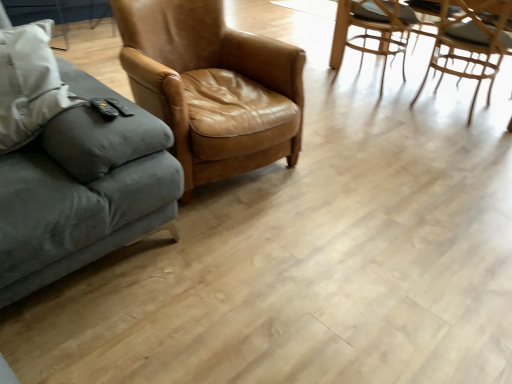
Question: Can you confirm if light brown woven chair at upper right, the 2th chair viewed from the right, is wider than velvet gray couch at left?

Choices:
 (A) yes
 (B) no

Answer: (B)

Question: From a real-world perspective, does light brown woven chair at upper right, positioned as the 2th chair in left-to-right order, stand above velvet gray couch at left?

Choices:
 (A) yes
 (B) no

Answer: (B)

Question: Can you confirm if light brown woven chair at upper right, the 2th chair viewed from the right, is bigger than velvet gray couch at left?

Choices:
 (A) yes
 (B) no

Answer: (B)

Question: Considering the relative sizes of light brown woven chair at upper right, the 2th chair viewed from the right, and velvet gray couch at left in the image provided, is light brown woven chair at upper right, the 2th chair viewed from the right, shorter than velvet gray couch at left?

Choices:
 (A) yes
 (B) no

Answer: (A)

Question: Is light brown woven chair at upper right, positioned as the 2th chair in left-to-right order, in front of velvet gray couch at left?

Choices:
 (A) no
 (B) yes

Answer: (A)

Question: Does light brown woven chair at upper right, the 2th chair viewed from the right, touch velvet gray couch at left?

Choices:
 (A) no
 (B) yes

Answer: (A)

Question: Can you confirm if brown leather chair at center, the 3th chair in the right-to-left sequence, is thinner than velvet gray couch at left?

Choices:
 (A) yes
 (B) no

Answer: (A)

Question: From the image's perspective, would you say brown leather chair at center, the 1th chair positioned from the left, is positioned over velvet gray couch at left?

Choices:
 (A) no
 (B) yes

Answer: (B)

Question: Is brown leather chair at center, the 3th chair in the right-to-left sequence, not within velvet gray couch at left?

Choices:
 (A) yes
 (B) no

Answer: (A)

Question: Does brown leather chair at center, the 3th chair in the right-to-left sequence, have a greater width compared to velvet gray couch at left?

Choices:
 (A) yes
 (B) no

Answer: (B)

Question: Does brown leather chair at center, the 3th chair in the right-to-left sequence, have a larger size compared to velvet gray couch at left?

Choices:
 (A) no
 (B) yes

Answer: (A)

Question: From a real-world perspective, is brown leather chair at center, the 1th chair positioned from the left, on velvet gray couch at left?

Choices:
 (A) yes
 (B) no

Answer: (B)

Question: Would you consider velvet gray couch at left to be distant from light brown woven chair at upper right, the 2th chair viewed from the right?

Choices:
 (A) yes
 (B) no

Answer: (A)